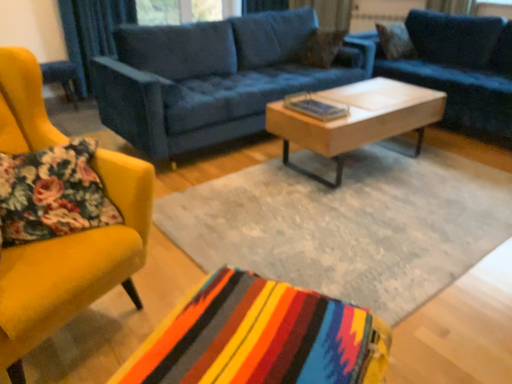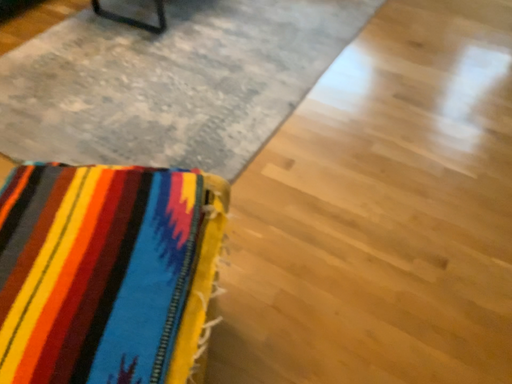
Question: How did the camera likely rotate when shooting the video?

Choices:
 (A) rotated left
 (B) rotated right

Answer: (B)